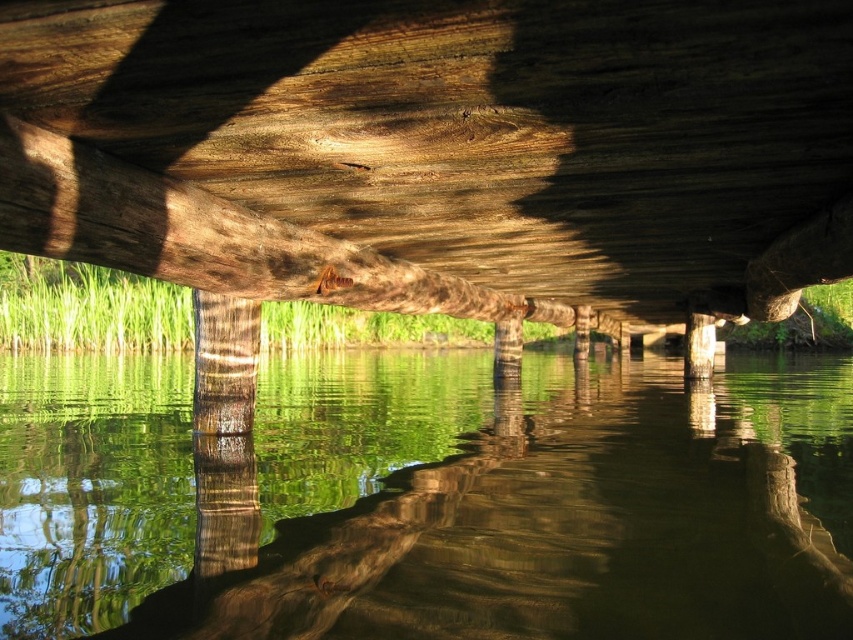
Question: Can you confirm if wooden beam at center is positioned below smooth brown tree trunk at center?

Choices:
 (A) yes
 (B) no

Answer: (B)

Question: Which of the following is the farthest from the observer?

Choices:
 (A) (688, 544)
 (B) (698, 264)
 (C) (221, 349)

Answer: (B)

Question: Does green reflective water at center have a larger size compared to smooth brown tree trunk at center?

Choices:
 (A) no
 (B) yes

Answer: (B)

Question: Can you confirm if wooden beam at center is thinner than smooth brown tree trunk at center?

Choices:
 (A) no
 (B) yes

Answer: (A)

Question: Which object is farther from the camera taking this photo?

Choices:
 (A) green reflective water at center
 (B) wooden beam at center

Answer: (B)

Question: Estimate the real-world distances between objects in this image. Which object is closer to the smooth brown tree trunk at center?

Choices:
 (A) wooden beam at center
 (B) green reflective water at center

Answer: (A)